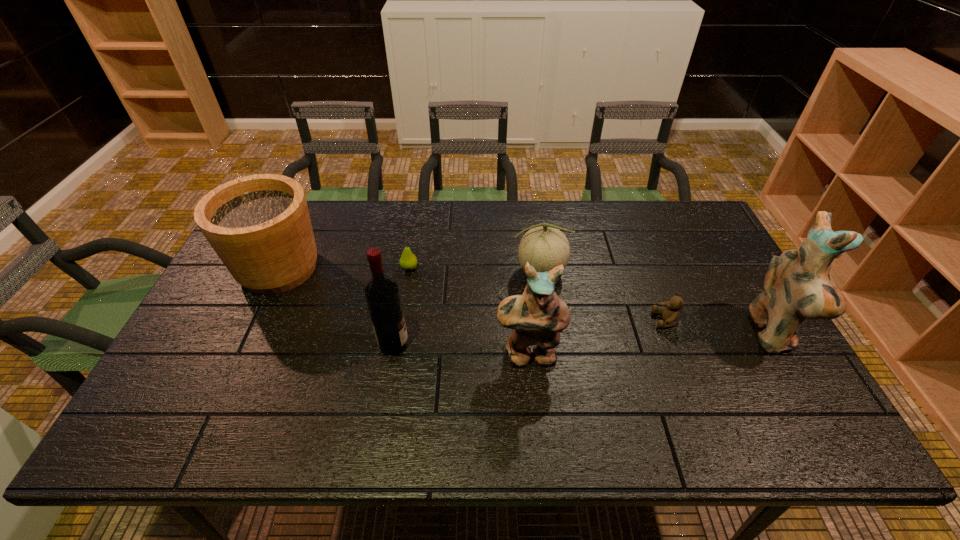
I want to click on vacant space located on the right of the pear, so click(505, 268).

Where is `free space located on the front of the cantaloup`? free space located on the front of the cantaloup is located at coordinates (545, 317).

Identify the location of vacant space located on the front of the fourth tallest object. (252, 327).

The height and width of the screenshot is (540, 960). I want to click on blank area located 0.350m on the front and back of the alcohol, so click(541, 343).

Where is `vacant space located on the front-facing side of the second object from right to left`? This screenshot has height=540, width=960. vacant space located on the front-facing side of the second object from right to left is located at coordinates (563, 320).

I want to click on free region located on the front-facing side of the second object from right to left, so click(577, 320).

Find the location of a particular element. free region located 0.050m on the front-facing side of the second object from right to left is located at coordinates (635, 320).

In order to click on object that is at the far edge in this screenshot , I will do `click(259, 225)`.

Where is `object located in the left edge section of the desktop`? This screenshot has width=960, height=540. object located in the left edge section of the desktop is located at coordinates (259, 225).

Where is `object situated at the right edge`? This screenshot has height=540, width=960. object situated at the right edge is located at coordinates (797, 286).